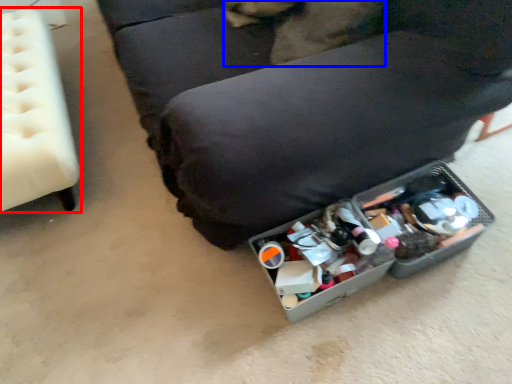
Question: Which object appears farthest to the camera in this image, furniture (highlighted by a red box) or animal (highlighted by a blue box)?

Choices:
 (A) furniture
 (B) animal

Answer: (A)